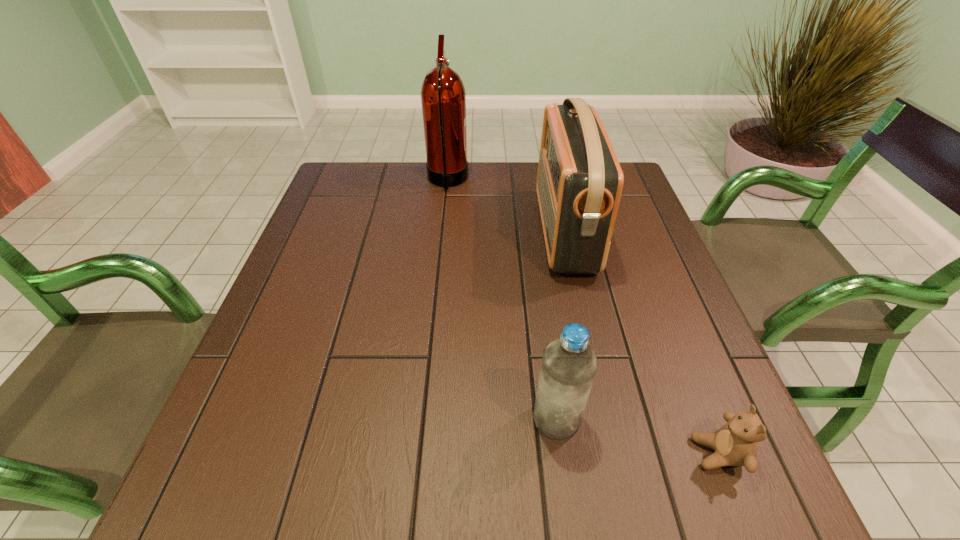
At what (x,y) coordinates should I click in order to perform the action: click on vacant space at the near edge of the desktop. Please return your answer as a coordinate pair (x, y). Looking at the image, I should click on (462, 513).

The height and width of the screenshot is (540, 960). In the image, there is a desktop. Identify the location of vacant space at the left edge. (369, 213).

In the image, there is a desktop. Where is `vacant space at the right edge`? Image resolution: width=960 pixels, height=540 pixels. vacant space at the right edge is located at coordinates (616, 222).

Identify the location of free spot at the far left corner of the desktop. (346, 163).

Where is `vacant space at the far right corner`? This screenshot has height=540, width=960. vacant space at the far right corner is located at coordinates (632, 201).

Identify the location of unoccupied area between the third tallest object and the radio receiver. (561, 325).

Find the location of a particular element. vacant point located between the shortest object and the third shortest object is located at coordinates (641, 342).

Locate an element on the screen. The height and width of the screenshot is (540, 960). empty space that is in between the second tallest object and the third tallest object is located at coordinates (x=561, y=325).

Image resolution: width=960 pixels, height=540 pixels. What are the coordinates of `unoccupied position between the third tallest object and the fire extinguisher` in the screenshot? It's located at (502, 300).

What are the coordinates of `empty space between the third shortest object and the tallest object` in the screenshot? It's located at tap(506, 206).